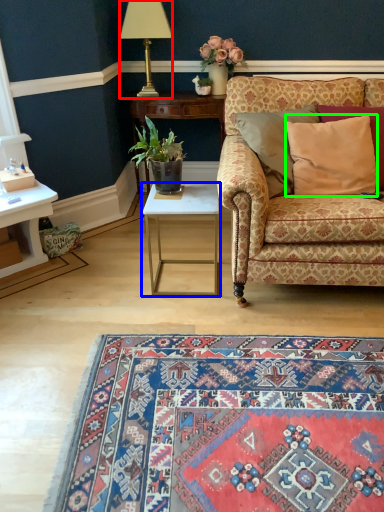
Question: Which is nearer to the lamp (highlighted by a red box)? table (highlighted by a blue box) or pillow (highlighted by a green box).

Choices:
 (A) table
 (B) pillow

Answer: (A)